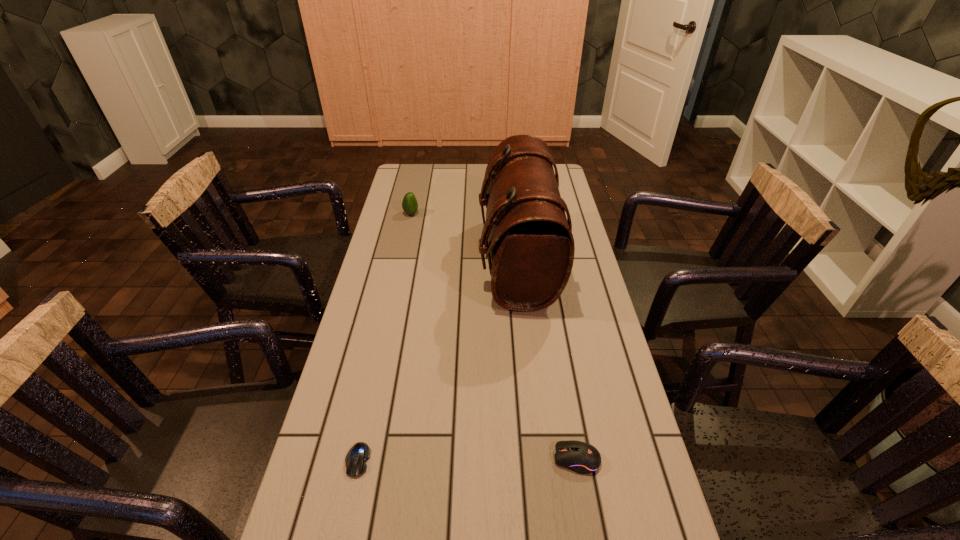
Locate an element on the screen. empty space that is in between the third shortest object and the taller computer mouse is located at coordinates (493, 336).

The width and height of the screenshot is (960, 540). I want to click on empty space that is in between the left computer mouse and the third shortest object, so tap(384, 337).

Locate an element on the screen. This screenshot has height=540, width=960. free spot between the second shortest object and the satchel is located at coordinates (547, 360).

Locate an element on the screen. The height and width of the screenshot is (540, 960). vacant space in between the second farthest object and the avocado is located at coordinates (465, 237).

Find the location of a particular element. The height and width of the screenshot is (540, 960). free space that is in between the taller computer mouse and the left computer mouse is located at coordinates (x=468, y=460).

Identify which object is the third closest to the farthest object. Please provide its 2D coordinates. Your answer should be formatted as a tuple, i.e. [(x, y)], where the tuple contains the x and y coordinates of a point satisfying the conditions above.

[(581, 457)]

Where is `object that ranks as the closest to the right computer mouse`? The image size is (960, 540). object that ranks as the closest to the right computer mouse is located at coordinates (356, 458).

Identify the location of vacant space that satisfies the following two spatial constraints: 1. on the front-facing side of the taller computer mouse; 2. on the right side of the third nearest object. (538, 459).

Locate an element on the screen. Image resolution: width=960 pixels, height=540 pixels. free space that satisfies the following two spatial constraints: 1. on the front-facing side of the tallest object; 2. on the button side of the shorter computer mouse is located at coordinates (538, 460).

Where is `vacant area that satisfies the following two spatial constraints: 1. on the front-facing side of the satchel; 2. on the right side of the right computer mouse`? vacant area that satisfies the following two spatial constraints: 1. on the front-facing side of the satchel; 2. on the right side of the right computer mouse is located at coordinates (538, 459).